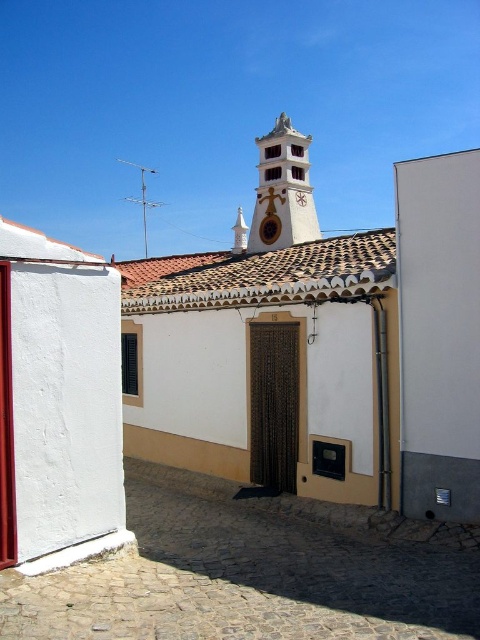
You are standing on the sunlit street and want to take a photo of both the white textured church at center and the white painted wood clock tower at upper center. Based on their positions, which one should you point your camera towards first to capture both in the frame?

Since the white textured church at center is to the left of the white painted wood clock tower at upper center, you should point your camera towards the white textured church at center first to ensure both are included in the frame.

You are an architect analyzing the building proportions. Which structure is taller between the white textured church at center and the white painted wood clock tower at upper center?

The white textured church at center is taller than the white painted wood clock tower at upper center according to the description.